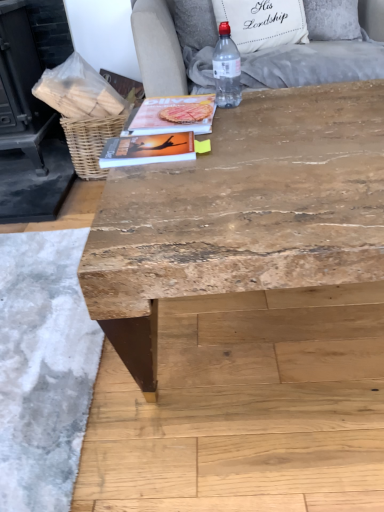
This screenshot has height=512, width=384. Find the location of `vacant area in front of clear plastic bottle at upper center`. vacant area in front of clear plastic bottle at upper center is located at coordinates (248, 122).